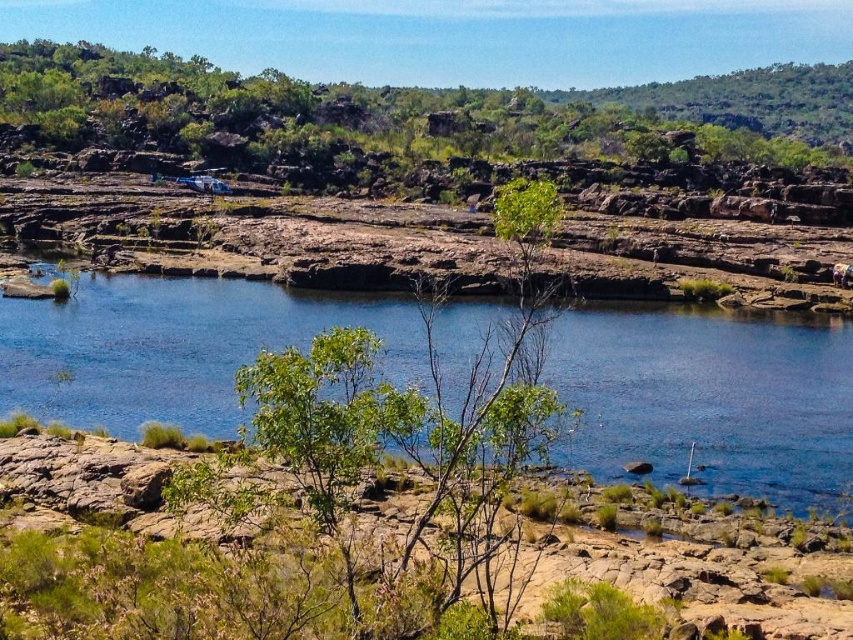
You are an observer looking at the landscape. Which object, the blue smooth water at center or the green leafy tree at upper center, appears narrower in the scene?

The blue smooth water at center is thinner than the green leafy tree at upper center, so the blue smooth water at center appears narrower in the scene.

You are standing at the rocky shoreline and want to walk towards the blue smooth water at center. Which direction should you head relative to the green leafy tree at upper center?

You should head to the right of the green leafy tree at upper center because the blue smooth water at center is located to the right of it.

You are a hiker who wants to cross the blue smooth water at center. The green leafy tree at upper center is your destination. Can you walk directly from the water to the tree without any obstacles?

The distance between the blue smooth water at center and the green leafy tree at upper center is 362.80 feet. However, the scene description mentions rocky terrain and sparse vegetation between them, so there may be obstacles like rocks and plants that could hinder your path. Therefore, you might not be able to walk directly to the tree without encountering obstacles.